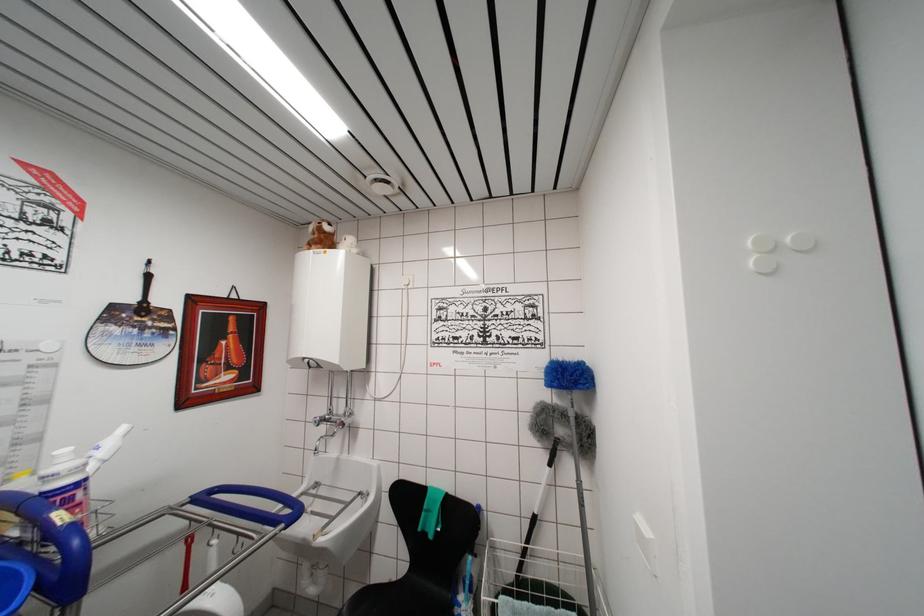
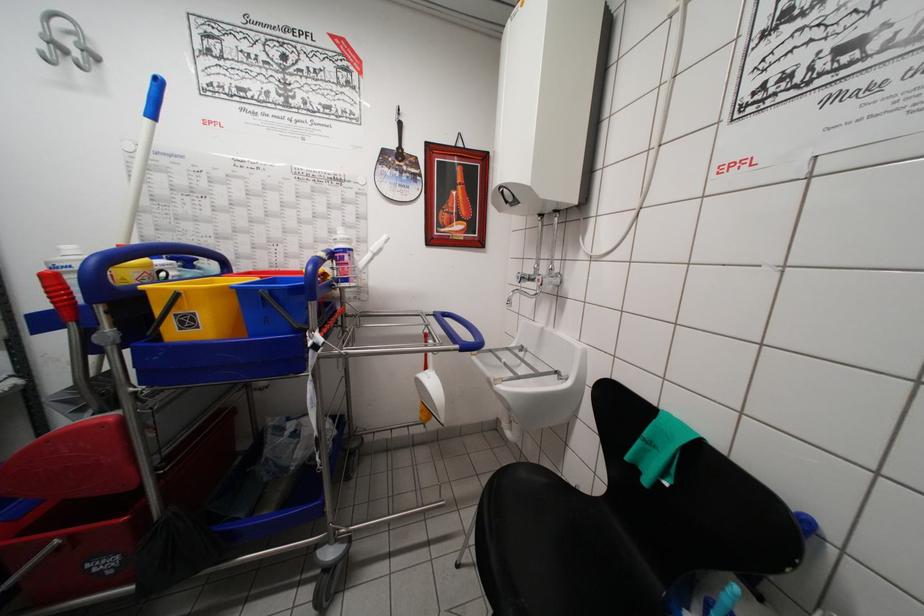
Where in the second image is the point corresponding to (x=312, y=371) from the first image?

(511, 207)